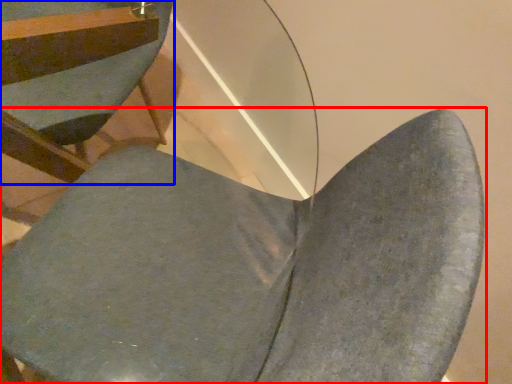
Question: Which point is further to the camera, chair (highlighted by a red box) or chair (highlighted by a blue box)?

Choices:
 (A) chair
 (B) chair

Answer: (B)